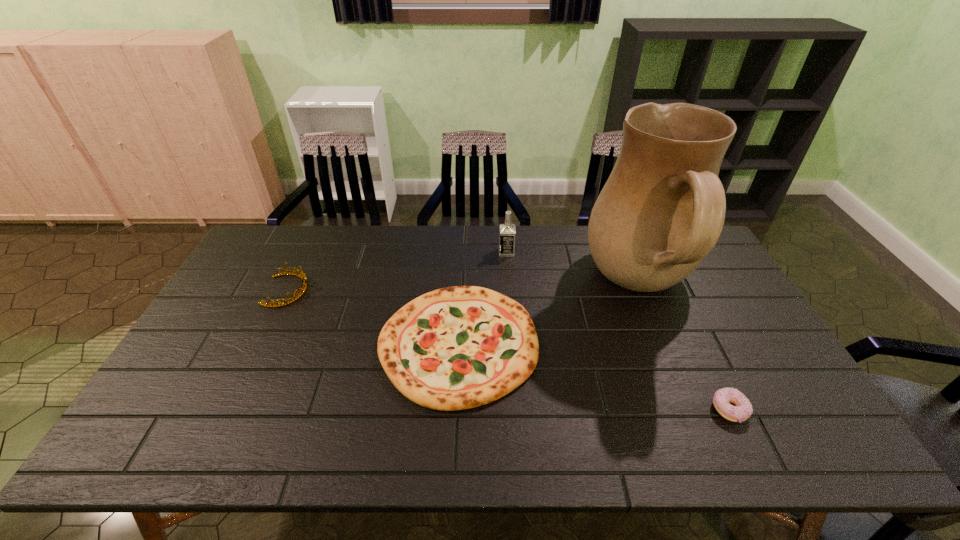
Find the location of a particular element. The width and height of the screenshot is (960, 540). free space between the vodka and the cream pitcher is located at coordinates (573, 269).

Find the location of a particular element. This screenshot has width=960, height=540. vacant space that's between the pizza and the doughnut is located at coordinates (593, 377).

Identify the location of free space that is in between the tallest object and the doughnut. The image size is (960, 540). (684, 348).

Identify the location of vacant area that lies between the cream pitcher and the second tallest object. The height and width of the screenshot is (540, 960). (573, 269).

Image resolution: width=960 pixels, height=540 pixels. I want to click on unoccupied position between the doughnut and the pizza, so click(x=593, y=377).

You are a GUI agent. You are given a task and a screenshot of the screen. Output one action in this format:
    pyautogui.click(x=<x>, y=<y>)
    Task: Click on the free space between the vodka and the cream pitcher
    This screenshot has height=540, width=960.
    Given the screenshot: What is the action you would take?
    pyautogui.click(x=573, y=269)

Locate which object is the fourth closest to the cream pitcher. Please provide its 2D coordinates. Your answer should be formatted as a tuple, i.e. [(x, y)], where the tuple contains the x and y coordinates of a point satisfying the conditions above.

[(303, 288)]

Identify which object is located as the fourth nearest to the leftmost object. Please provide its 2D coordinates. Your answer should be formatted as a tuple, i.e. [(x, y)], where the tuple contains the x and y coordinates of a point satisfying the conditions above.

[(742, 409)]

Find the location of a particular element. This screenshot has width=960, height=540. vacant region that satisfies the following two spatial constraints: 1. at the spout of the tallest object; 2. on the back side of the doughnut is located at coordinates (690, 410).

The height and width of the screenshot is (540, 960). In order to click on vacant area in the image that satisfies the following two spatial constraints: 1. on the front label of the doughnut; 2. on the right side of the second tallest object in this screenshot , I will do `click(518, 410)`.